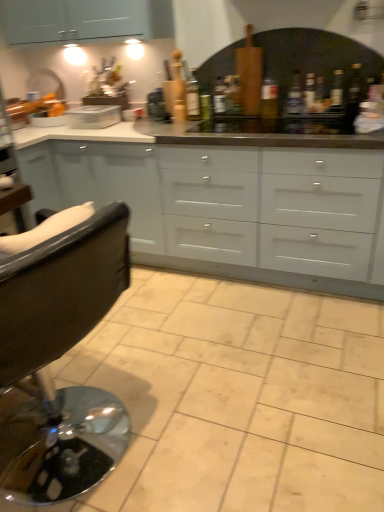
Identify the location of free space to the left of translucent glass bottle at upper center, placed as the fourth bottle when sorted from left to right. (266, 121).